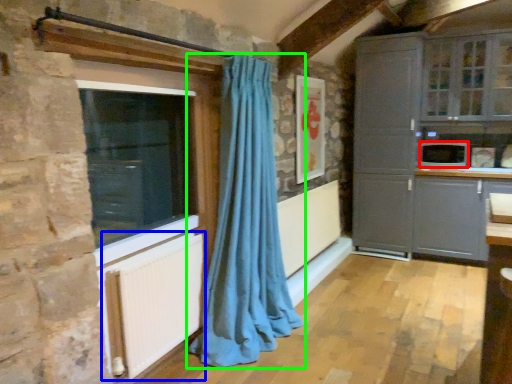
Question: Which object is positioned farthest from appliance (highlighted by a red box)? Select from radiator (highlighted by a blue box) and curtain (highlighted by a green box).

Choices:
 (A) radiator
 (B) curtain

Answer: (A)